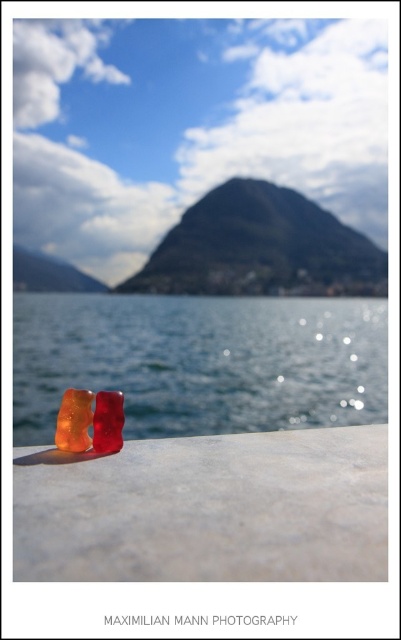
Question: Does glistening water at center have a smaller size compared to matte black mountain at upper center?

Choices:
 (A) yes
 (B) no

Answer: (B)

Question: Which point is farther to the camera?

Choices:
 (A) (107, 294)
 (B) (42, 268)
 (C) (216, 289)
 (D) (378, 490)

Answer: (B)

Question: Which object appears closest to the camera in this image?

Choices:
 (A) matte black mountain at upper center
 (B) matte stone gummy bears at center

Answer: (B)

Question: Does matte stone gummy bears at center appear over matte black mountain at upper center?

Choices:
 (A) yes
 (B) no

Answer: (B)

Question: Which point is closer to the camera taking this photo?

Choices:
 (A) (311, 564)
 (B) (30, 280)

Answer: (A)

Question: Is matte stone gummy bears at center wider than smooth brown mountain at center?

Choices:
 (A) no
 (B) yes

Answer: (A)